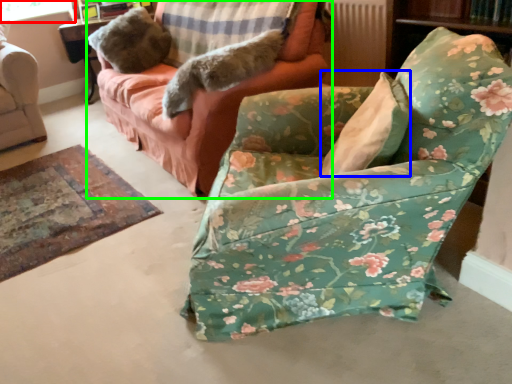
Question: Which object is positioned closest to window screen (highlighted by a red box)? Select from pillow (highlighted by a blue box) and studio couch (highlighted by a green box).

Choices:
 (A) pillow
 (B) studio couch

Answer: (B)